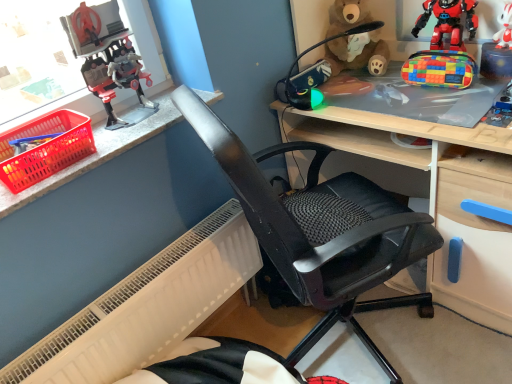
I want to click on vacant space to the left of multicolored fabric pencil case at upper right, which is the 3th toy from left to right, so click(394, 98).